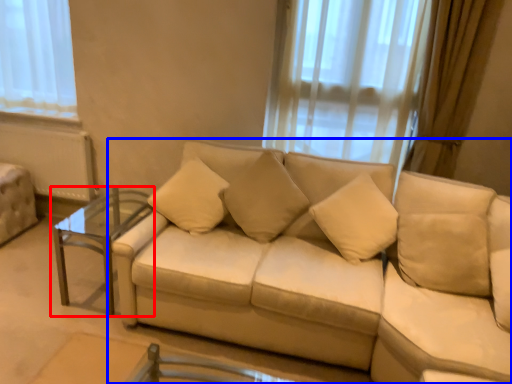
Question: Which point is closer to the camera, table (highlighted by a red box) or studio couch (highlighted by a blue box)?

Choices:
 (A) table
 (B) studio couch

Answer: (B)